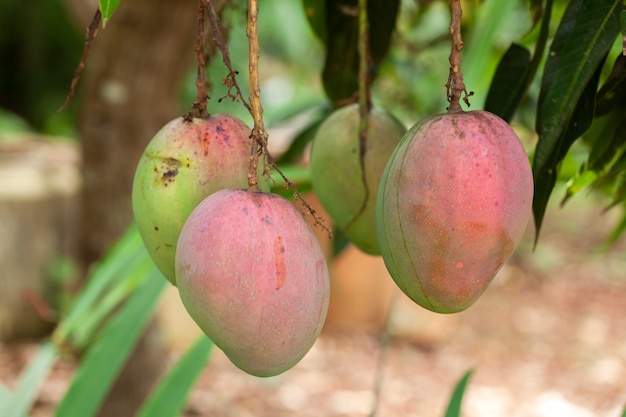
Locate an element on the screen. This screenshot has height=417, width=626. wall is located at coordinates click(34, 219).